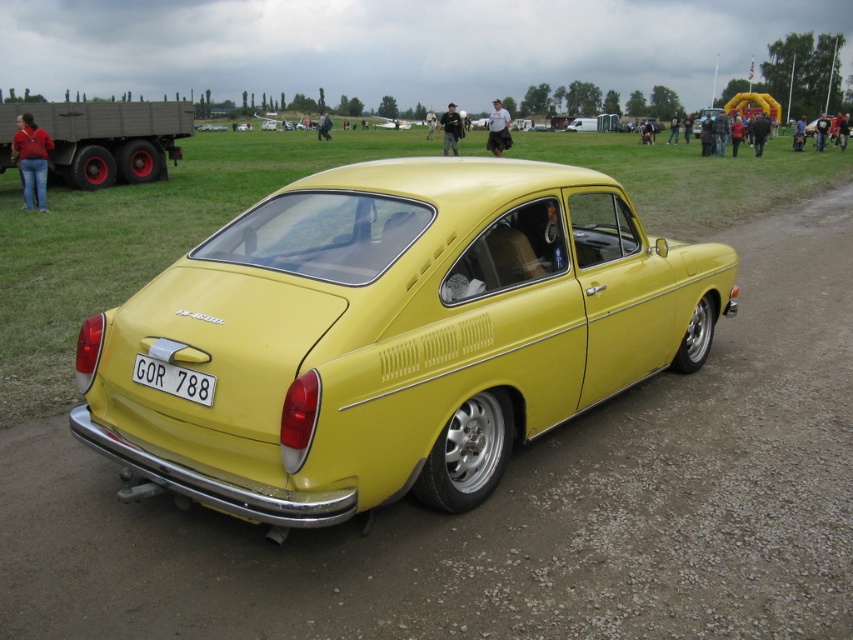
You are standing at the origin point in the image. The yellow matte car at center is located at point (393, 336). Can you determine the direction of the yellow matte car at center relative to your position?

The yellow matte car at center is located at point (393, 336), which means it is to the northeast of your position at the origin.

You are a photographer trying to capture a clear photo of the white plastic license plate at rear of the yellow matte car at center. Considering the size difference between the two, will the license plate be easily visible in the photo if you focus on the car?

The yellow matte car at center is larger than the white plastic license plate at rear, so the license plate will be smaller in the photo but still visible if focused properly.